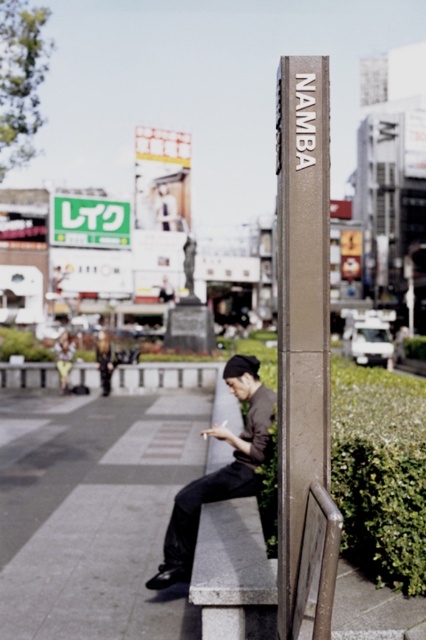
Question: Does gray concrete pavement at lower center have a smaller size compared to bronze metallic signpost at center?

Choices:
 (A) yes
 (B) no

Answer: (B)

Question: Which point is closer to the camera?

Choices:
 (A) green plastic sign at upper center
 (B) dark gray fabric jacket at center

Answer: (B)

Question: Based on their relative distances, which object is farther from the gray concrete pavement at lower center?

Choices:
 (A) dark gray fabric jacket at center
 (B) bronze metallic signpost at center
 (C) green plastic sign at upper center

Answer: (C)

Question: Which object is positioned farthest from the bronze metallic signpost at center?

Choices:
 (A) green plastic sign at upper center
 (B) dark gray fabric jacket at center
 (C) gray concrete pavement at lower center

Answer: (A)

Question: Does dark gray fabric jacket at center appear under green plastic sign at upper center?

Choices:
 (A) yes
 (B) no

Answer: (A)

Question: Does gray concrete pavement at lower center have a larger size compared to bronze metallic signpost at center?

Choices:
 (A) yes
 (B) no

Answer: (A)